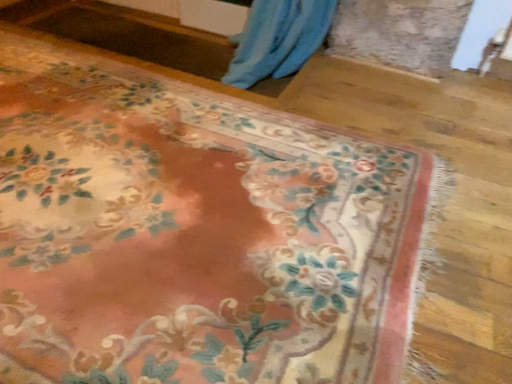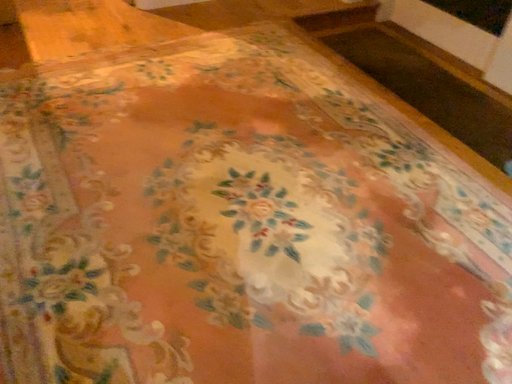
Question: How did the camera likely rotate when shooting the video?

Choices:
 (A) rotated downward
 (B) rotated upward

Answer: (B)